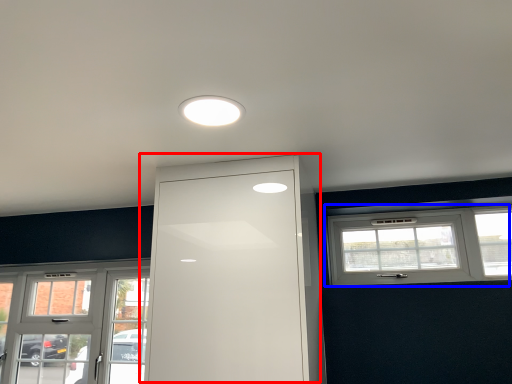
Question: Among these objects, which one is farthest to the camera, door (highlighted by a red box) or window (highlighted by a blue box)?

Choices:
 (A) door
 (B) window

Answer: (B)